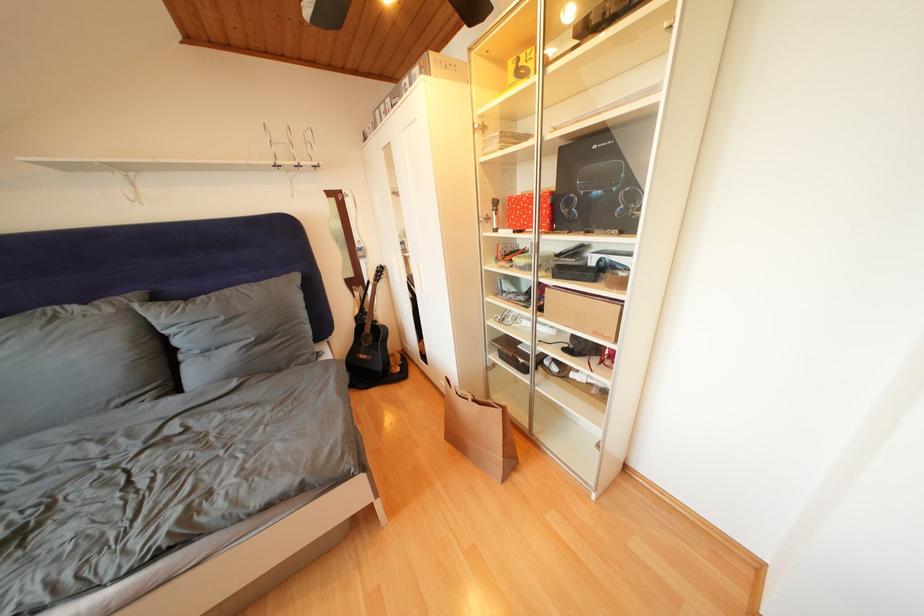
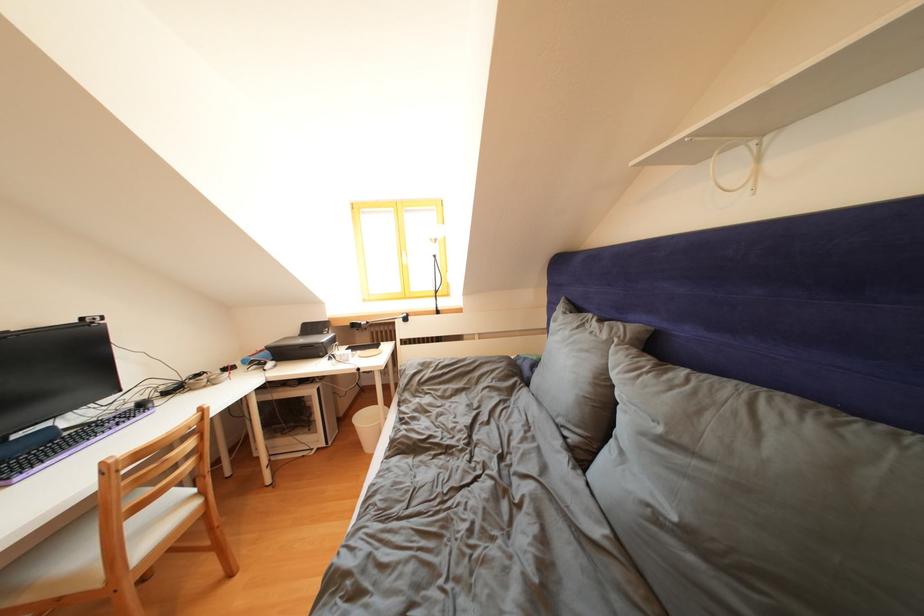
Find the pixel in the second image that matches [117,315] in the first image.

(612, 341)